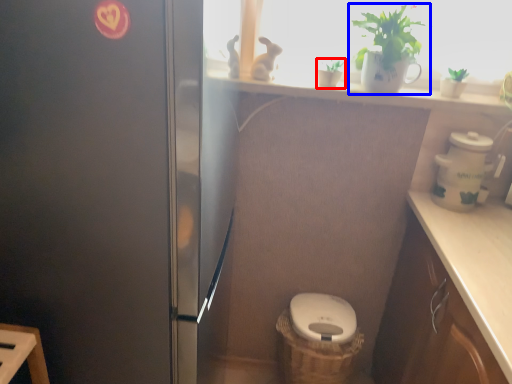
Question: Which object appears farthest to the camera in this image, houseplant (highlighted by a red box) or houseplant (highlighted by a blue box)?

Choices:
 (A) houseplant
 (B) houseplant

Answer: (A)